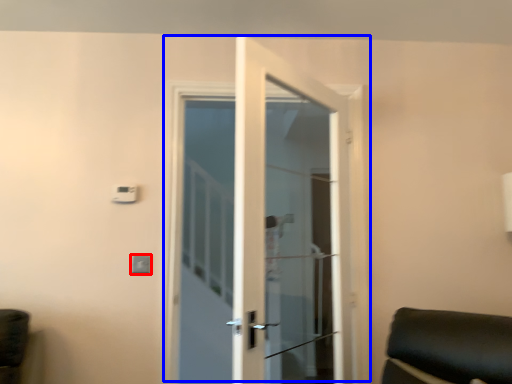
Question: Which of the following is the closest to the observer, light switch (highlighted by a red box) or door (highlighted by a blue box)?

Choices:
 (A) light switch
 (B) door

Answer: (B)